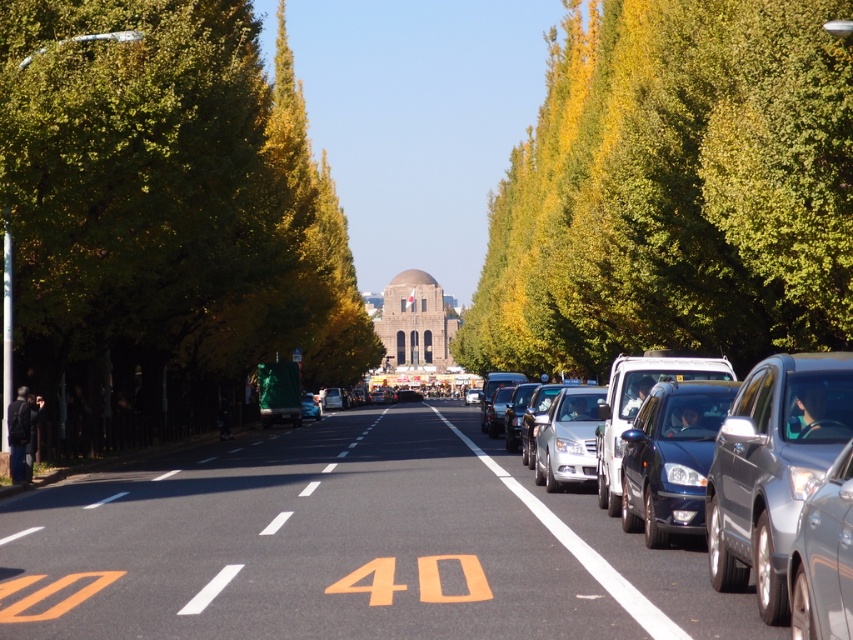
Which is below, green leafy tree at right or shiny blue sedan at right?

shiny blue sedan at right

Which is more to the left, green leafy tree at right or shiny blue sedan at right?

Positioned to the left is shiny blue sedan at right.

In order to click on green leafy tree at right in this screenshot , I will do `click(675, 192)`.

Image resolution: width=853 pixels, height=640 pixels. Find the location of `green leafy tree at right`. green leafy tree at right is located at coordinates (675, 192).

Is satin silver sedan at right to the right of sleek silver sedan at right from the viewer's perspective?

Correct, you'll find satin silver sedan at right to the right of sleek silver sedan at right.

Is satin silver sedan at right further to the viewer compared to sleek silver sedan at right?

Yes, satin silver sedan at right is behind sleek silver sedan at right.

Is point (798, 499) positioned in front of point (843, 602)?

No, it is behind (843, 602).

Locate an element on the screen. satin silver sedan at right is located at coordinates (772, 468).

Describe the element at coordinates (770, 468) in the screenshot. I see `shiny silver sedan at right` at that location.

Is shiny silver sedan at right positioned before sleek silver sedan at right?

No, it is not.

What do you see at coordinates (770, 468) in the screenshot? The width and height of the screenshot is (853, 640). I see `shiny silver sedan at right` at bounding box center [770, 468].

Find the location of a particular element. shiny silver sedan at right is located at coordinates (770, 468).